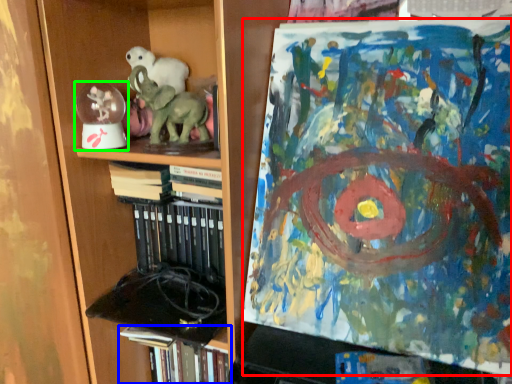
Question: Which object is positioned closest to art (highlighted by a red box)? Select from book (highlighted by a blue box) and toy (highlighted by a green box).

Choices:
 (A) book
 (B) toy

Answer: (A)